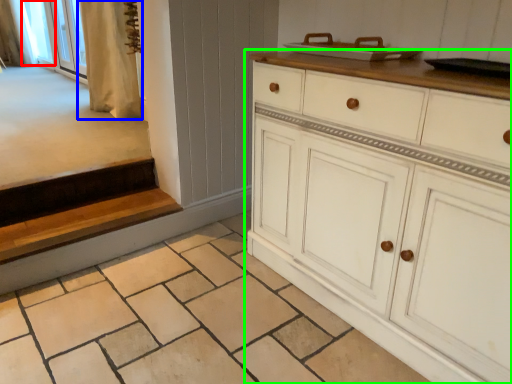
Question: Based on their relative distances, which object is nearer to window screen (highlighted by a red box)? Choose from curtain (highlighted by a blue box) and chest of drawers (highlighted by a green box).

Choices:
 (A) curtain
 (B) chest of drawers

Answer: (A)